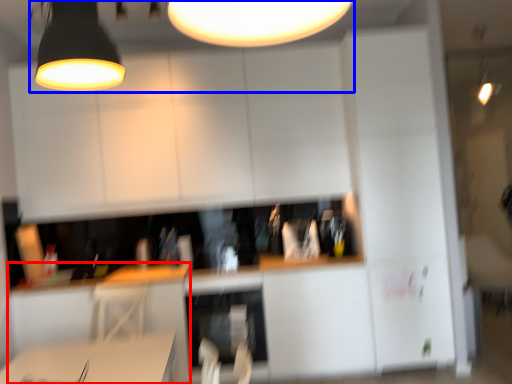
Question: Among these objects, which one is farthest to the camera, computer desk (highlighted by a red box) or lamp (highlighted by a blue box)?

Choices:
 (A) computer desk
 (B) lamp

Answer: (B)